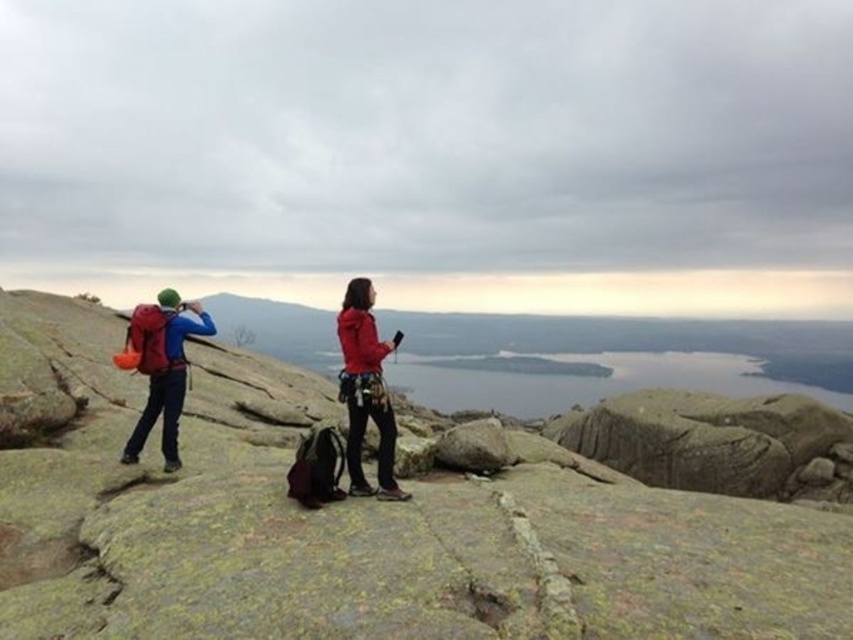
Which of these two, red matte jacket at center or matte red backpack at left, stands taller?

Standing taller between the two is red matte jacket at center.

At what (x,y) coordinates should I click in order to perform the action: click on red matte jacket at center. Please return your answer as a coordinate pair (x, y). This screenshot has height=640, width=853. Looking at the image, I should click on (364, 388).

Where is `red matte jacket at center`? Image resolution: width=853 pixels, height=640 pixels. red matte jacket at center is located at coordinates (364, 388).

Which is in front, point (154, 592) or point (155, 394)?

Point (154, 592) is in front.

What do you see at coordinates (355, 524) in the screenshot? I see `gray rock at center` at bounding box center [355, 524].

Identify the location of gray rock at center. The height and width of the screenshot is (640, 853). (355, 524).

In the scene shown: Is gray rock at center to the right of matte blue jacket at center from the viewer's perspective?

Incorrect, gray rock at center is not on the right side of matte blue jacket at center.

Does gray rock at center appear over matte blue jacket at center?

Actually, gray rock at center is below matte blue jacket at center.

Image resolution: width=853 pixels, height=640 pixels. What do you see at coordinates (355, 524) in the screenshot? I see `gray rock at center` at bounding box center [355, 524].

This screenshot has height=640, width=853. What are the coordinates of `gray rock at center` in the screenshot? It's located at (355, 524).